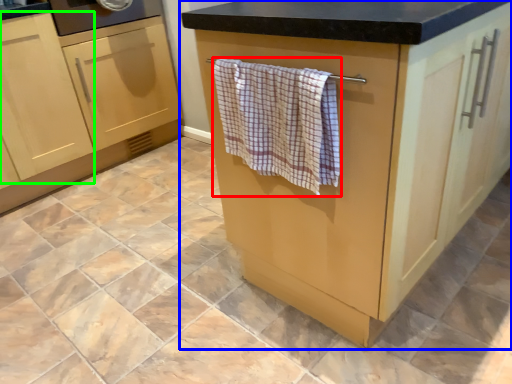
Question: Based on their relative distances, which object is nearer to bath towel (highlighted by a red box)? Choose from cabinetry (highlighted by a blue box) and cabinetry (highlighted by a green box).

Choices:
 (A) cabinetry
 (B) cabinetry

Answer: (A)